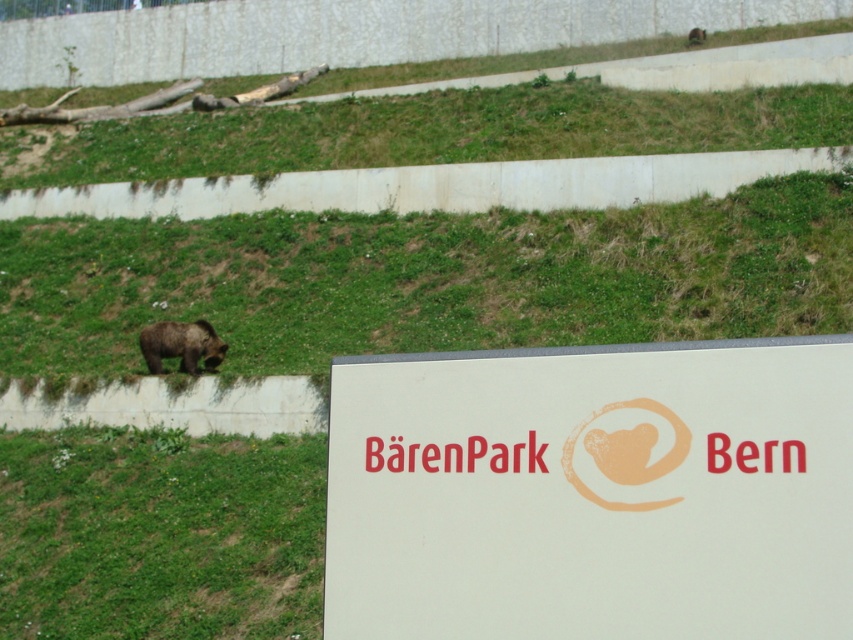
Based on the photo, you are a visitor at the BarenPark Bern and want to take a photo of the brown furry bear at lower left. However, you notice the white matte sign at center is blocking your view. Can you move the sign to get a clear shot of the bear?

The white matte sign at center is in front of the brown furry bear at lower left, so moving the sign would allow you to see the bear clearly. However, since the sign is part of the park infrastructure, you should not move it. Instead, try moving your position to capture the bear without obstructing the sign.